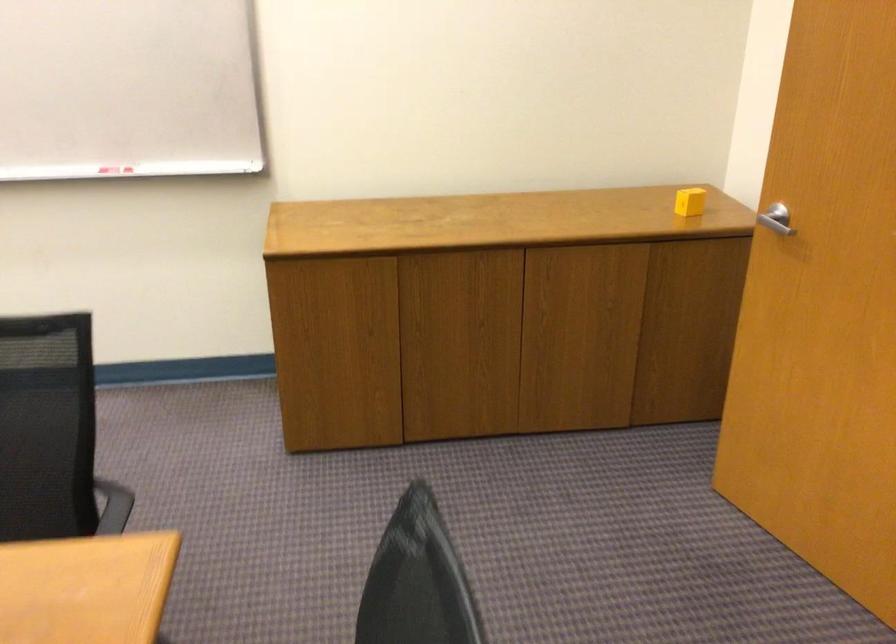
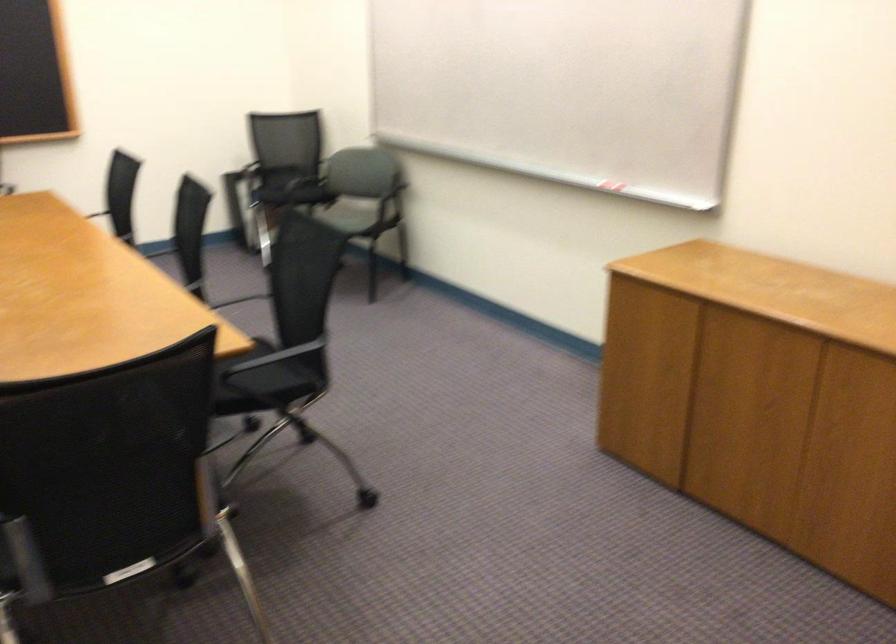
Where in the second image is the point corresponding to (108,178) from the first image?

(608, 187)